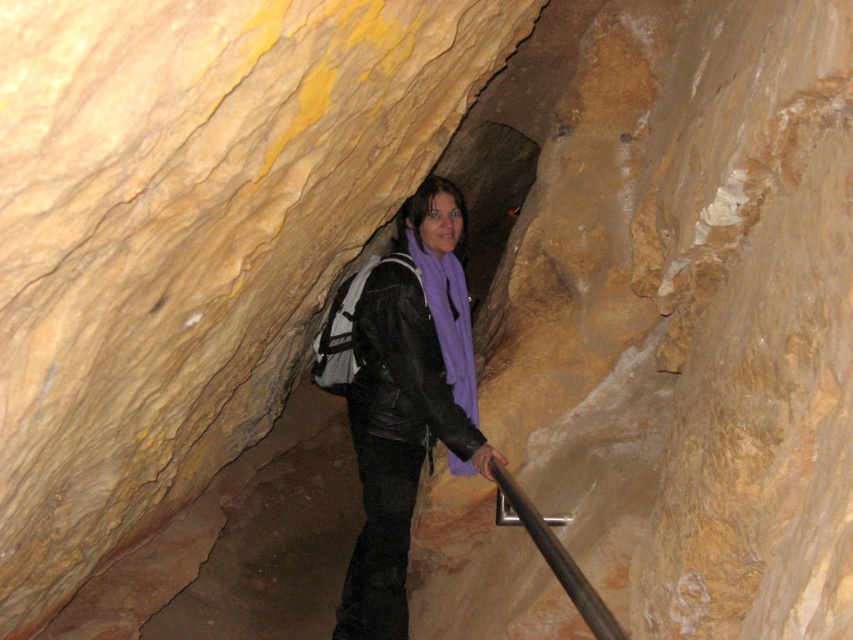
Question: Does purple matte scarf at center appear under black leather jacket at center?

Choices:
 (A) yes
 (B) no

Answer: (A)

Question: Which object is farther from the camera taking this photo?

Choices:
 (A) black leather jacket at center
 (B) black metal rail at center
 (C) purple matte scarf at center

Answer: (A)

Question: Which object is farther from the camera taking this photo?

Choices:
 (A) black metal rail at center
 (B) purple matte scarf at center
 (C) black leather jacket at center

Answer: (C)

Question: Which point is closer to the camera?

Choices:
 (A) black leather jacket at center
 (B) black metal rail at center
 (C) purple matte scarf at center

Answer: (B)

Question: Is purple matte scarf at center in front of black metal rail at center?

Choices:
 (A) yes
 (B) no

Answer: (B)

Question: Is the position of black leather jacket at center more distant than that of black metal rail at center?

Choices:
 (A) yes
 (B) no

Answer: (A)